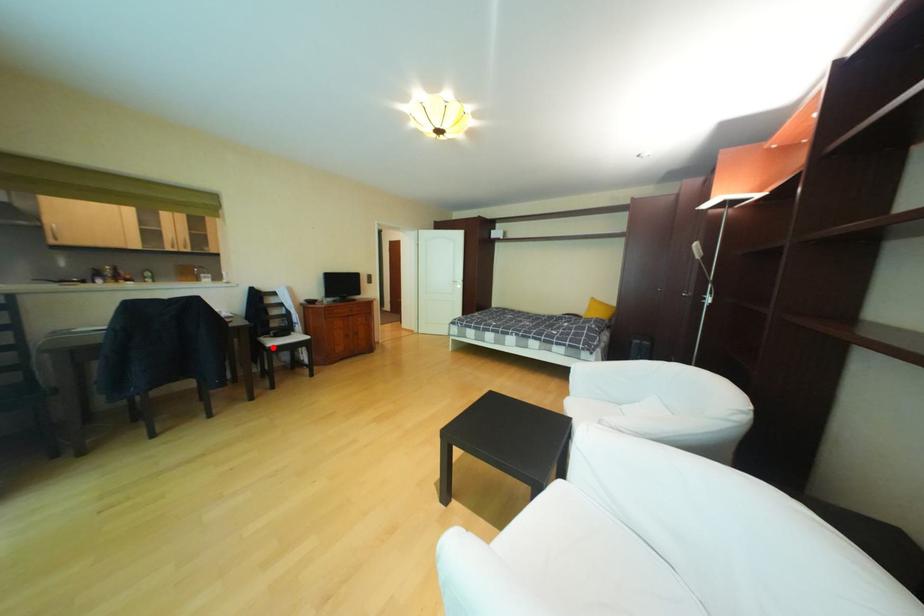
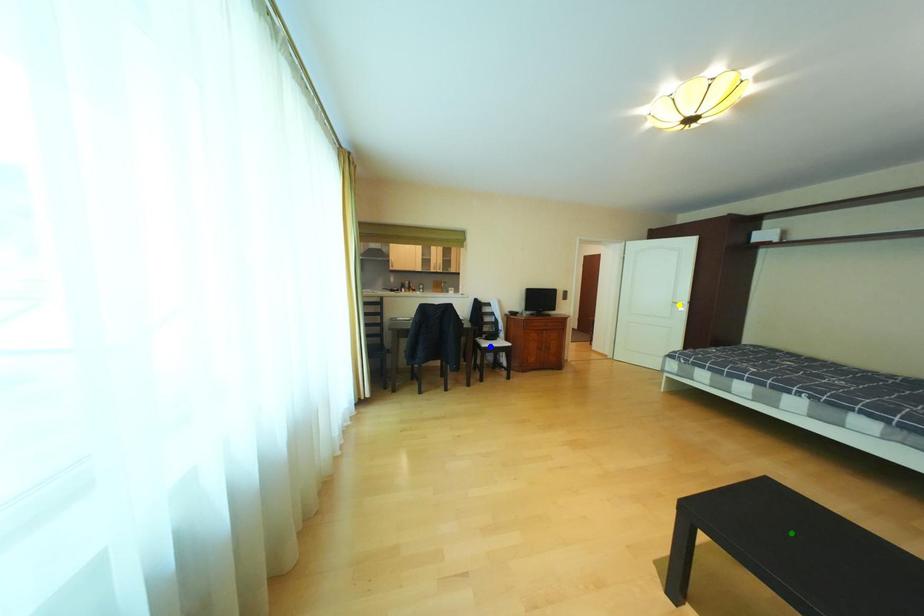
Question: I am providing you with two images of the same scene from different viewpoints. A red point is marked on the first image. You are given multiple points on the second image. Which point in image 2 is actually the same real-world point as the red point in image 1?

Choices:
 (A) green point
 (B) yellow point
 (C) blue point

Answer: (C)